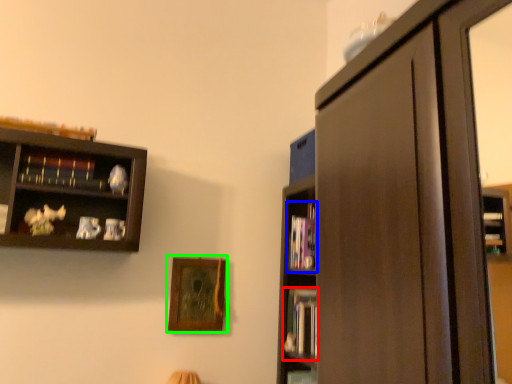
Question: Which object is the farthest from book (highlighted by a red box)? Choose among these: book (highlighted by a blue box) or picture frame (highlighted by a green box).

Choices:
 (A) book
 (B) picture frame

Answer: (B)